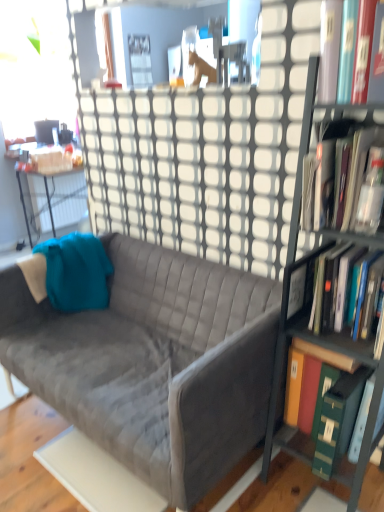
You are a GUI agent. You are given a task and a screenshot of the screen. Output one action in this format:
    pyautogui.click(x=<x>, y=<y>)
    Task: Click on the free point above green hardcover book at right, marked as the 4th book in a top-to-bottom arrangement (from a real-world perspective)
    
    Given the screenshot: What is the action you would take?
    pyautogui.click(x=341, y=348)